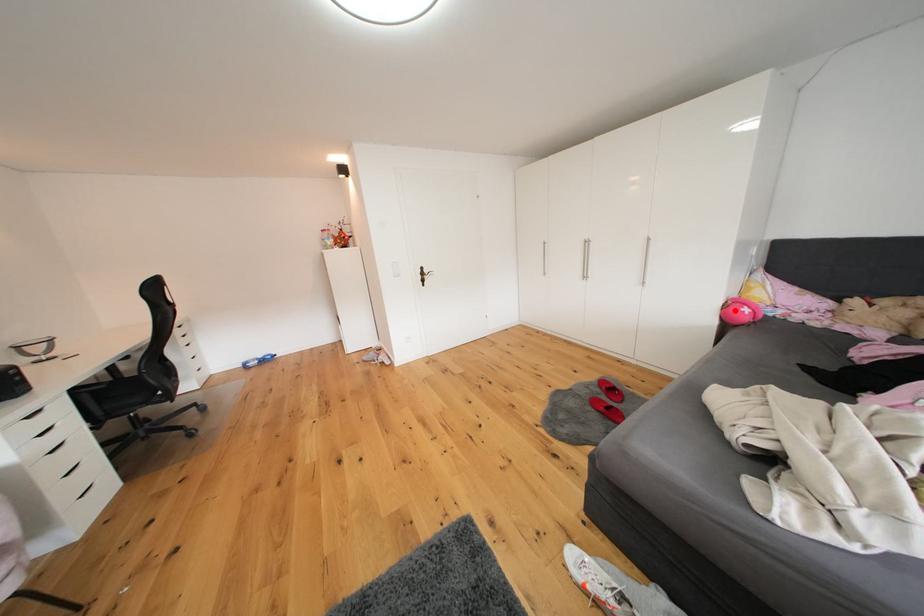
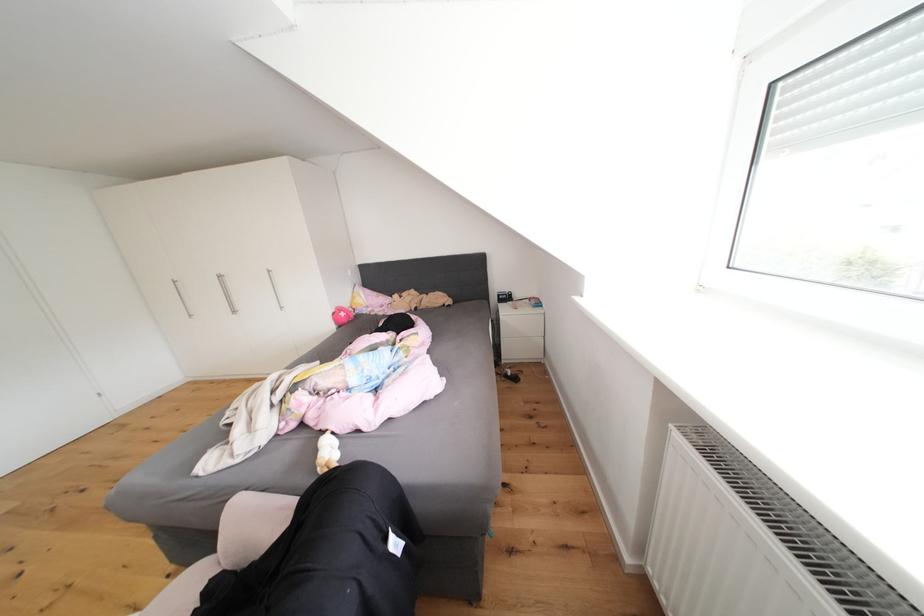
Question: I am providing you with two images of the same scene from different viewpoints. In image1, a red point is highlighted. Considering the same 3D point in image2, which of the following is correct?

Choices:
 (A) It is closer
 (B) It is farther

Answer: (A)